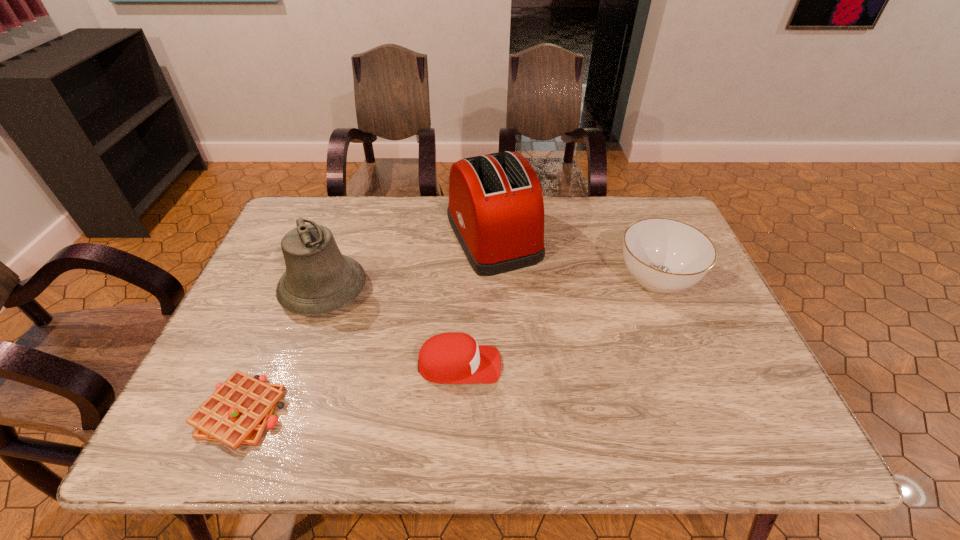
The width and height of the screenshot is (960, 540). I want to click on free space located on the right of the shortest object, so click(427, 412).

Where is `object at the far edge`? object at the far edge is located at coordinates (496, 210).

Identify the location of object at the near edge. (238, 412).

Locate an element on the screen. The image size is (960, 540). bell positioned at the left edge is located at coordinates (318, 279).

Locate an element on the screen. waffle at the left edge is located at coordinates (238, 412).

Find the location of a particular element. object at the right edge is located at coordinates (663, 255).

Locate an element on the screen. object situated at the near left corner is located at coordinates (238, 412).

Where is `vacant space at the far edge of the desktop`? The height and width of the screenshot is (540, 960). vacant space at the far edge of the desktop is located at coordinates (372, 235).

Identify the location of vacant space at the near edge of the desktop. The image size is (960, 540). (394, 451).

Locate an element on the screen. This screenshot has width=960, height=540. free space at the left edge of the desktop is located at coordinates (287, 328).